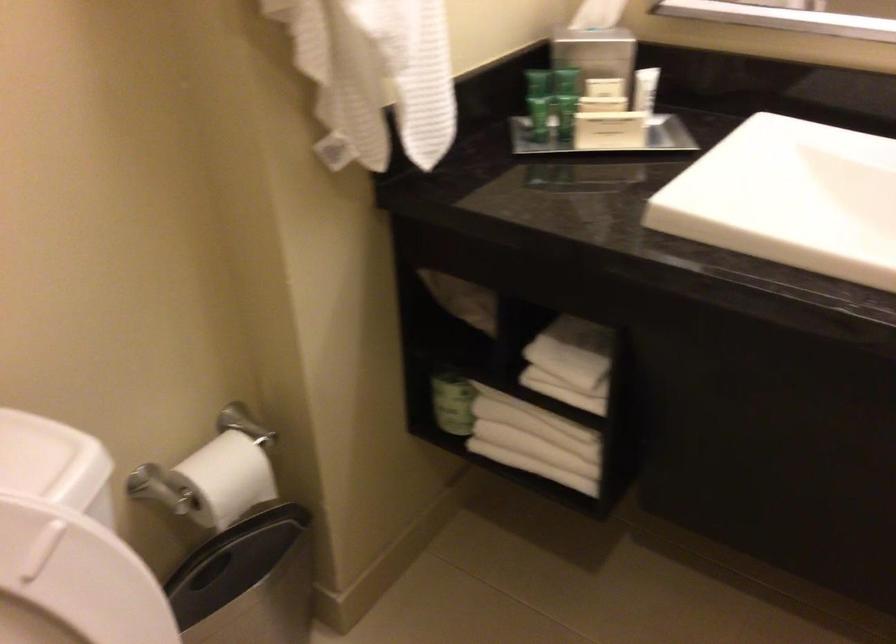
Where would you lift the green can? Please return your answer as a coordinate pair (x, y).

(564, 100)